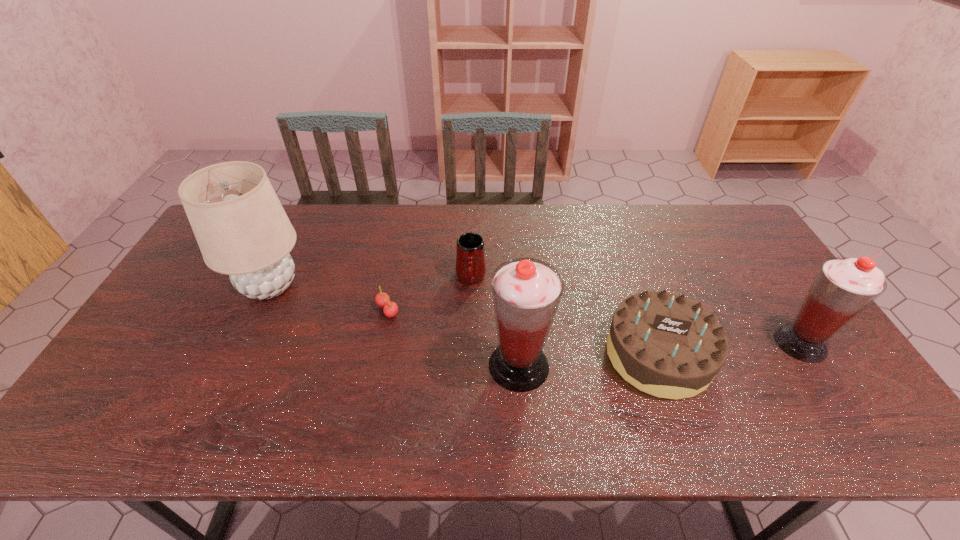
Where is `free space at the left edge`? free space at the left edge is located at coordinates (227, 278).

Where is `blank region between the cherry and the third tallest object`? blank region between the cherry and the third tallest object is located at coordinates (594, 327).

Locate an element on the screen. The height and width of the screenshot is (540, 960). empty space that is in between the lampshade and the fourth object from left to right is located at coordinates (395, 326).

Where is `empty space between the birthday cake and the left smoothie`? empty space between the birthday cake and the left smoothie is located at coordinates (588, 360).

Find the location of a particular element. The height and width of the screenshot is (540, 960). free space between the leftmost object and the fifth object from right to left is located at coordinates (328, 298).

At what (x,y) coordinates should I click in order to perform the action: click on empty location between the third object from left to right and the leftmost object. Please return your answer as a coordinate pair (x, y). Looking at the image, I should click on (371, 282).

The width and height of the screenshot is (960, 540). What are the coordinates of `vacant space that is in between the mug and the lampshade` in the screenshot? It's located at (371, 282).

Find the location of a particular element. The image size is (960, 540). blank region between the birthday cake and the lampshade is located at coordinates (465, 320).

Find the location of a particular element. This screenshot has width=960, height=540. vacant space in between the mug and the cherry is located at coordinates (429, 294).

Locate an element on the screen. The width and height of the screenshot is (960, 540). vacant area that lies between the left smoothie and the birthday cake is located at coordinates (588, 360).